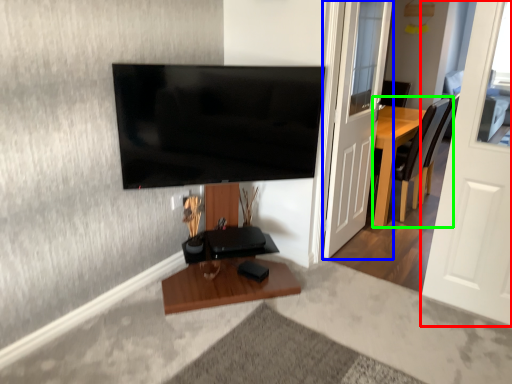
Question: Estimate the real-world distances between objects in this image. Which object is farther from door (highlighted by a red box), door (highlighted by a blue box) or chair (highlighted by a green box)?

Choices:
 (A) door
 (B) chair

Answer: (B)